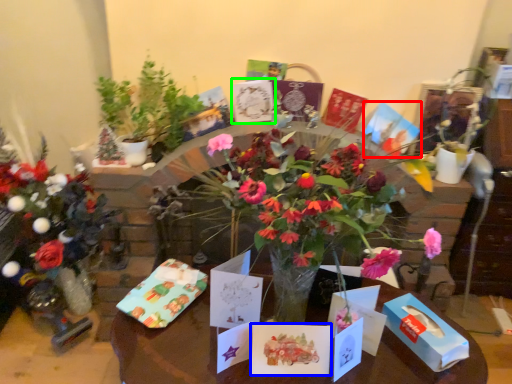
Question: Based on their relative distances, which object is farther from birthday card (highlighted by a red box)? Choose from birthday card (highlighted by a blue box) and birthday card (highlighted by a green box).

Choices:
 (A) birthday card
 (B) birthday card

Answer: (A)